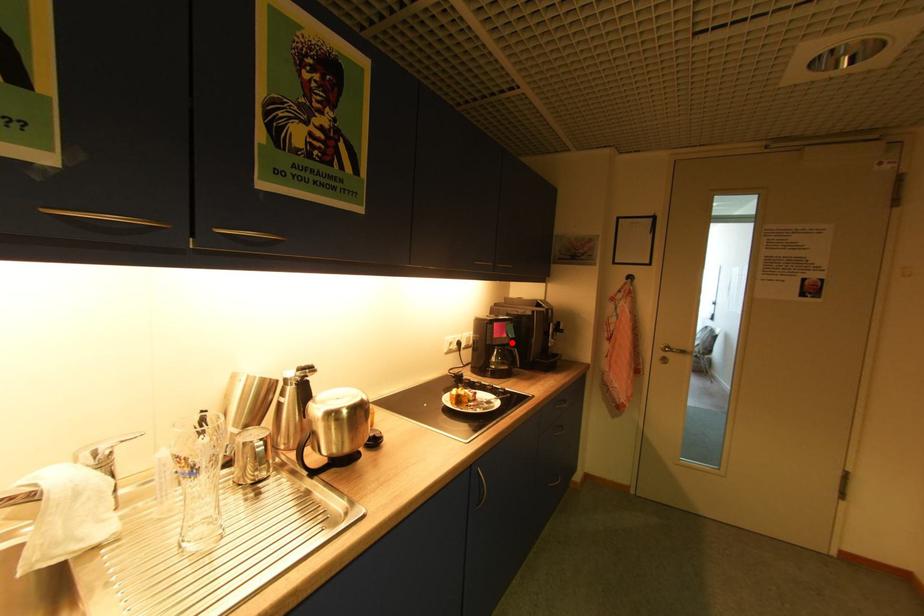
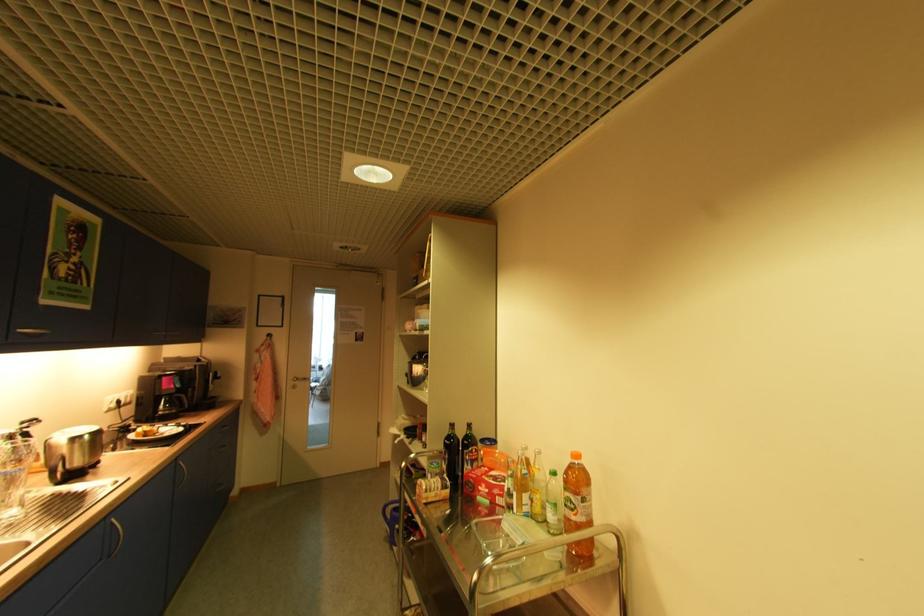
Where in the second image is the point corresponding to the highlighted location from the first image?

(178, 392)